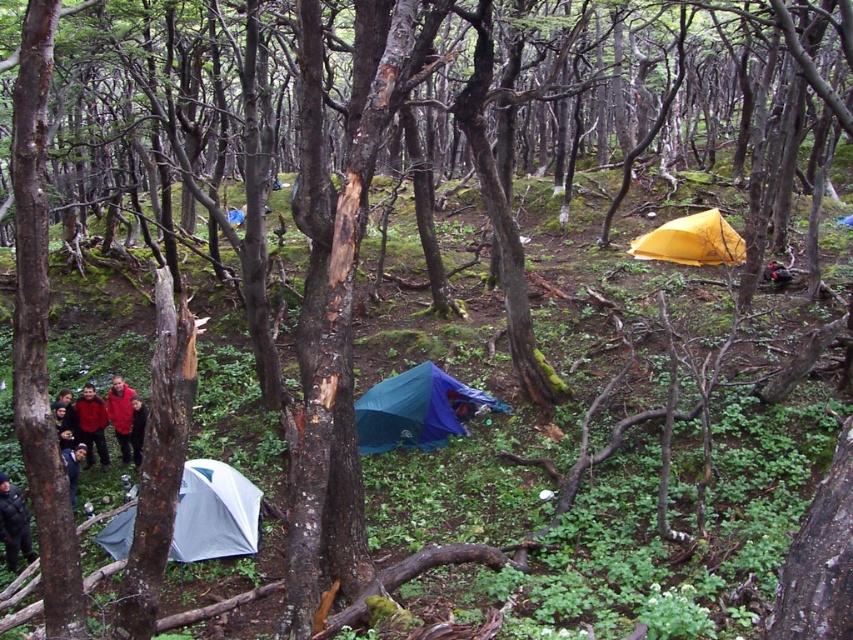
You are planning to set up a new tent in this forest scene. You have a small camping stove that requires at least 1.5 meters of clearance above it to avoid the tent roof. Given the blue tarpaulin tent at center and the yellow matte tent at upper right, which tent would be more suitable for placing the stove inside?

The yellow matte tent at upper right is taller than the blue tarpaulin tent at center, so placing the stove inside the yellow matte tent at upper right would provide the necessary clearance required.

You are a hiker who just arrived at the campsite and want to find your tent. You remember that your tent is located at point (x=13, y=524). According to the scene description, what color is your tent?

The point (x=13, y=524) corresponds to the dark gray uniform at lower left, so your tent is dark gray.

You are a hiker who just arrived at the campsite. You notice two items at the lower left corner of your view. One is labeled as dark gray uniform at lower left and the other is dark blue jeans at lower left. Which item is positioned lower in your field of view?

The dark gray uniform at lower left is located below dark blue jeans at lower left, so it is positioned lower in your field of view.